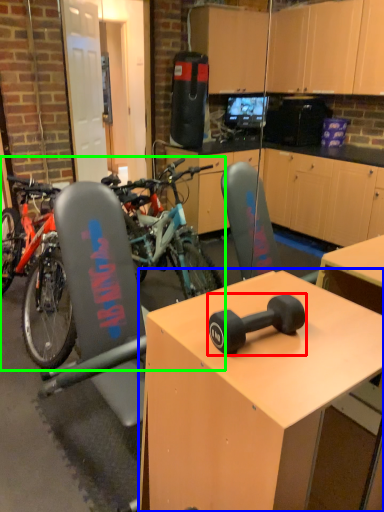
Question: Estimate the real-world distances between objects in this image. Which object is farther from dumbbell (highlighted by a red box), desk (highlighted by a blue box) or mountain bike (highlighted by a green box)?

Choices:
 (A) desk
 (B) mountain bike

Answer: (B)